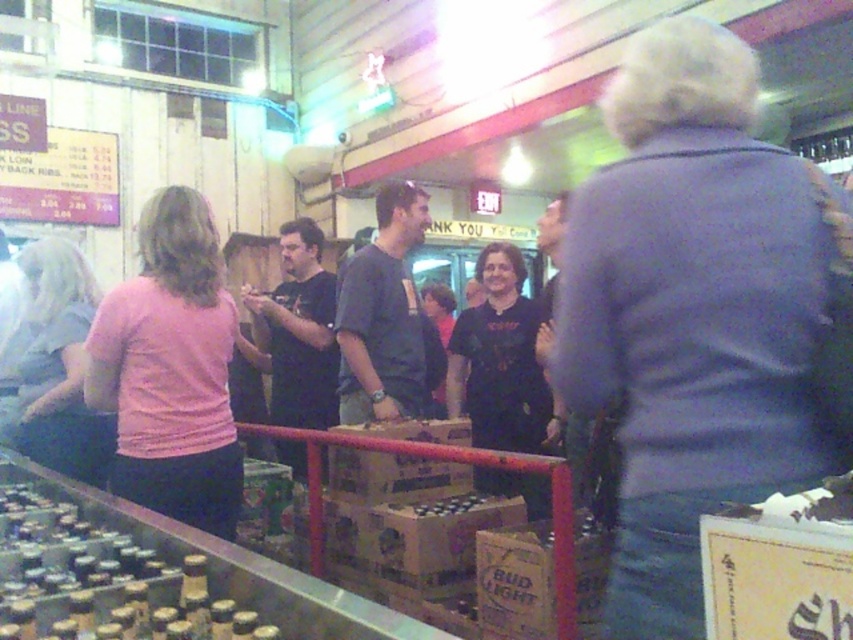
Question: From the image, what is the correct spatial relationship of pink matte shirt at center in relation to dark gray t-shirt at center?

Choices:
 (A) below
 (B) above

Answer: (A)

Question: Among these points, which one is nearest to the camera?

Choices:
 (A) (641, 172)
 (B) (189, 214)

Answer: (A)

Question: Can you confirm if pink matte shirt at center is wider than black matte shirt at center?

Choices:
 (A) yes
 (B) no

Answer: (B)

Question: Which point is closer to the camera?

Choices:
 (A) (20, 352)
 (B) (228, 516)
 (C) (308, 259)

Answer: (B)

Question: In this image, where is matte pink shirt at left located relative to dark gray t-shirt at center?

Choices:
 (A) above
 (B) below

Answer: (B)

Question: Considering the real-world distances, which object is farthest from the black matte shirt at center?

Choices:
 (A) pink matte shirt at center
 (B) purple sweater at center
 (C) dark gray t-shirt at center

Answer: (B)